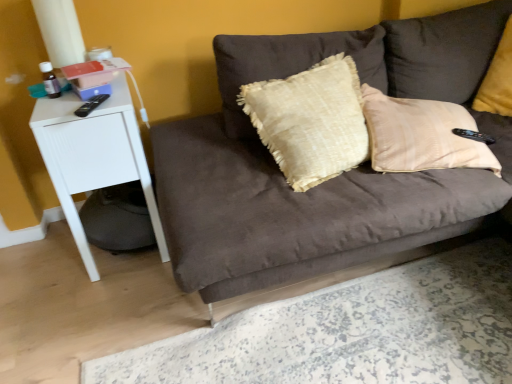
Question: Relative to velvet yellow pillow at upper right, is suede brown couch at center in front or behind?

Choices:
 (A) front
 (B) behind

Answer: (A)

Question: From the image's perspective, is suede brown couch at center located above or below velvet yellow pillow at upper right?

Choices:
 (A) below
 (B) above

Answer: (A)

Question: Estimate the real-world distances between objects in this image. Which object is closer to the velvet yellow pillow at upper right?

Choices:
 (A) suede brown couch at center
 (B) white matte side table at left

Answer: (A)

Question: Estimate the real-world distances between objects in this image. Which object is closer to the suede brown couch at center?

Choices:
 (A) white matte side table at left
 (B) velvet yellow pillow at upper right

Answer: (A)